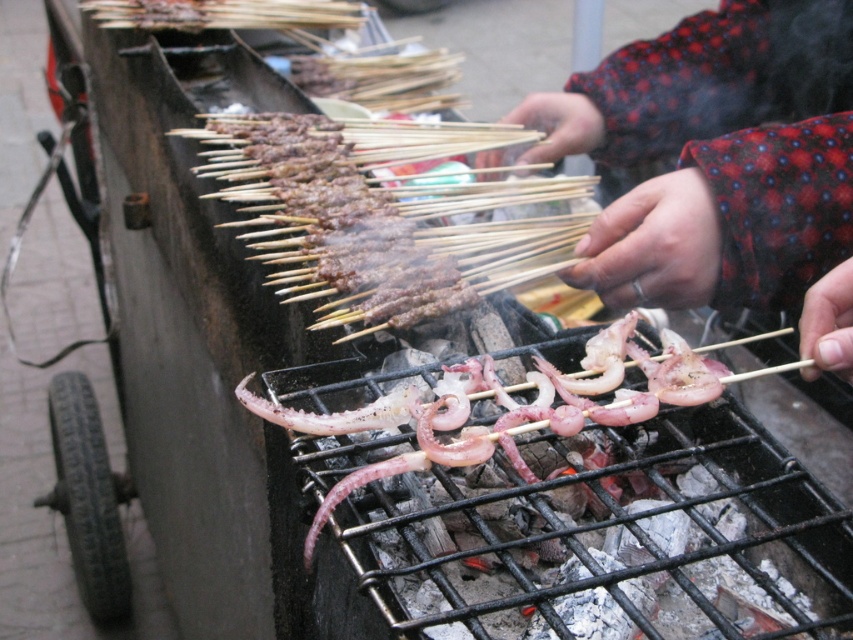
Where is `brown charred skewers at center`? brown charred skewers at center is located at coordinates (329, 221).

Can you confirm if brown charred skewers at center is positioned to the right of pink translucent squid at center?

Incorrect, brown charred skewers at center is not on the right side of pink translucent squid at center.

Identify the location of brown charred skewers at center. This screenshot has width=853, height=640. (329, 221).

Is red dotted sweater at center to the left of brown charred skewers at center from the viewer's perspective?

No, red dotted sweater at center is not to the left of brown charred skewers at center.

Is red dotted sweater at center thinner than brown charred skewers at center?

Indeed, red dotted sweater at center has a lesser width compared to brown charred skewers at center.

The image size is (853, 640). Describe the element at coordinates (711, 180) in the screenshot. I see `red dotted sweater at center` at that location.

Locate an element on the screen. The image size is (853, 640). red dotted sweater at center is located at coordinates (711, 180).

This screenshot has width=853, height=640. What are the coordinates of `red dotted sweater at center` in the screenshot? It's located at (711, 180).

Identify the location of red dotted sweater at center. (711, 180).

Where is `red dotted sweater at center`? Image resolution: width=853 pixels, height=640 pixels. red dotted sweater at center is located at coordinates [x=711, y=180].